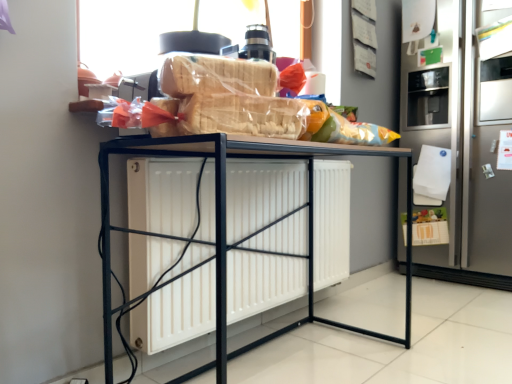
Question: Considering the relative positions of satin silver refrigerator at right and black metal table at center in the image provided, is satin silver refrigerator at right to the left or to the right of black metal table at center?

Choices:
 (A) right
 (B) left

Answer: (A)

Question: Based on their sizes in the image, would you say satin silver refrigerator at right is bigger or smaller than black metal table at center?

Choices:
 (A) small
 (B) big

Answer: (B)

Question: In terms of height, does satin silver refrigerator at right look taller or shorter compared to black metal table at center?

Choices:
 (A) tall
 (B) short

Answer: (A)

Question: Visually, is black metal table at center positioned to the left or to the right of satin silver refrigerator at right?

Choices:
 (A) right
 (B) left

Answer: (B)

Question: Is black metal table at center in front of or behind satin silver refrigerator at right in the image?

Choices:
 (A) behind
 (B) front

Answer: (B)

Question: Does point click(x=102, y=317) appear closer or farther from the camera than point click(x=474, y=173)?

Choices:
 (A) closer
 (B) farther

Answer: (A)

Question: In terms of size, does black metal table at center appear bigger or smaller than satin silver refrigerator at right?

Choices:
 (A) big
 (B) small

Answer: (B)